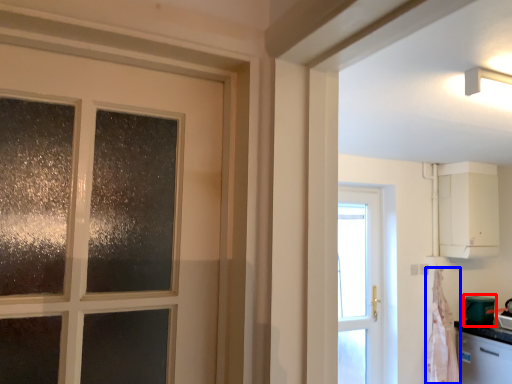
Question: Which point is closer to the camera, appliance (highlighted by a red box) or curtain (highlighted by a blue box)?

Choices:
 (A) appliance
 (B) curtain

Answer: (B)